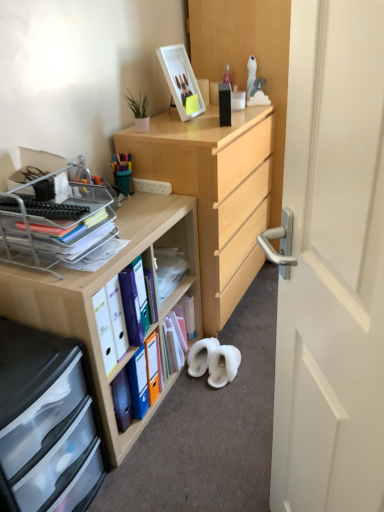
Question: Could you tell me if wooden desk at center is turned towards multicolored plastic pen holder at upper left?

Choices:
 (A) no
 (B) yes

Answer: (A)

Question: Can we say wooden desk at center lies outside multicolored plastic pen holder at upper left?

Choices:
 (A) no
 (B) yes

Answer: (B)

Question: From the image's perspective, is wooden desk at center located above multicolored plastic pen holder at upper left?

Choices:
 (A) no
 (B) yes

Answer: (A)

Question: Does wooden desk at center have a greater width compared to multicolored plastic pen holder at upper left?

Choices:
 (A) no
 (B) yes

Answer: (B)

Question: From a real-world perspective, is wooden desk at center located beneath multicolored plastic pen holder at upper left?

Choices:
 (A) no
 (B) yes

Answer: (B)

Question: Is multicolored plastic pen holder at upper left to the left or to the right of wooden desk at center in the image?

Choices:
 (A) left
 (B) right

Answer: (A)

Question: Is point (112, 160) closer or farther from the camera than point (114, 221)?

Choices:
 (A) farther
 (B) closer

Answer: (A)

Question: Considering the positions of multicolored plastic pen holder at upper left and wooden desk at center in the image, is multicolored plastic pen holder at upper left bigger or smaller than wooden desk at center?

Choices:
 (A) small
 (B) big

Answer: (A)

Question: Is multicolored plastic pen holder at upper left wider or thinner than wooden desk at center?

Choices:
 (A) wide
 (B) thin

Answer: (B)

Question: Is multicolored plastic pen holder at upper left wider or thinner than white glossy picture frame at upper center?

Choices:
 (A) wide
 (B) thin

Answer: (B)

Question: From the image's perspective, is multicolored plastic pen holder at upper left positioned above or below white glossy picture frame at upper center?

Choices:
 (A) above
 (B) below

Answer: (B)

Question: In terms of height, does multicolored plastic pen holder at upper left look taller or shorter compared to white glossy picture frame at upper center?

Choices:
 (A) tall
 (B) short

Answer: (B)

Question: Would you say multicolored plastic pen holder at upper left is inside or outside white glossy picture frame at upper center?

Choices:
 (A) outside
 (B) inside

Answer: (A)

Question: Is point (160, 52) positioned closer to the camera than point (44, 404)?

Choices:
 (A) farther
 (B) closer

Answer: (A)

Question: From a real-world perspective, is white glossy picture frame at upper center physically located above or below transparent plastic drawers at lower left?

Choices:
 (A) below
 (B) above

Answer: (B)